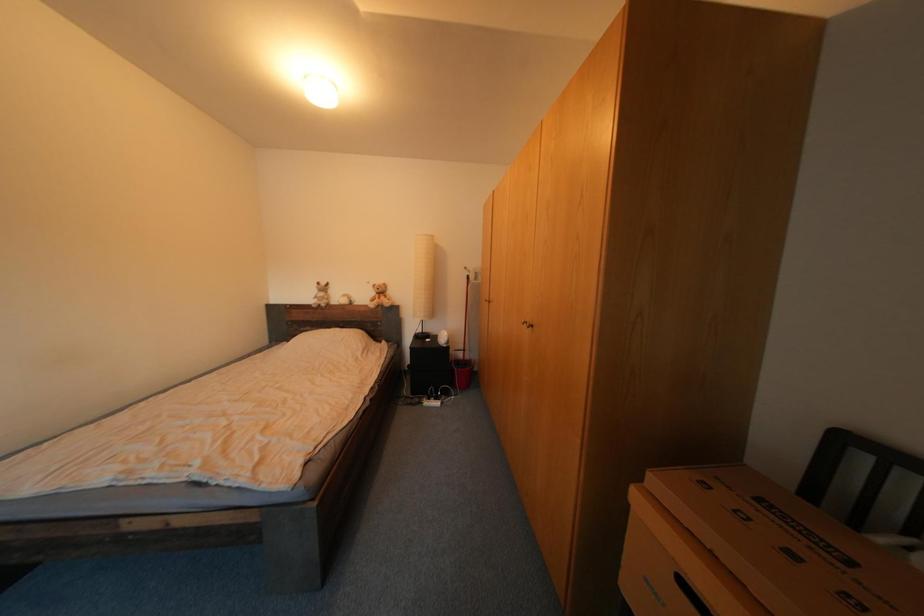
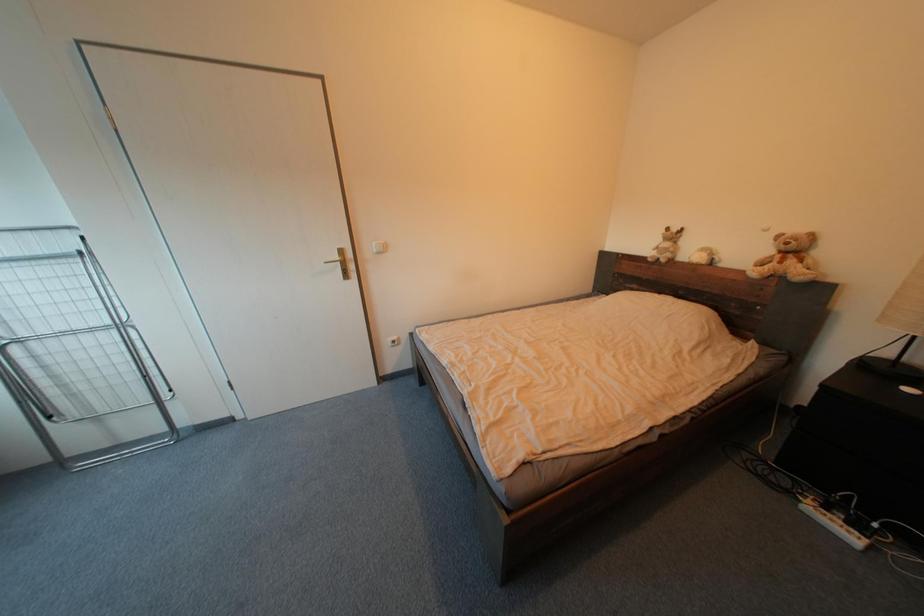
The images are taken continuously from a first-person perspective. In which direction is your viewpoint rotating?

The camera rotated toward left-down.